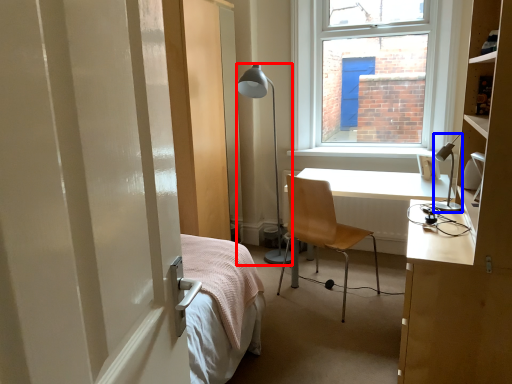
Question: Among these objects, which one is nearest to the camera, lamp (highlighted by a red box) or lamp (highlighted by a blue box)?

Choices:
 (A) lamp
 (B) lamp

Answer: (B)